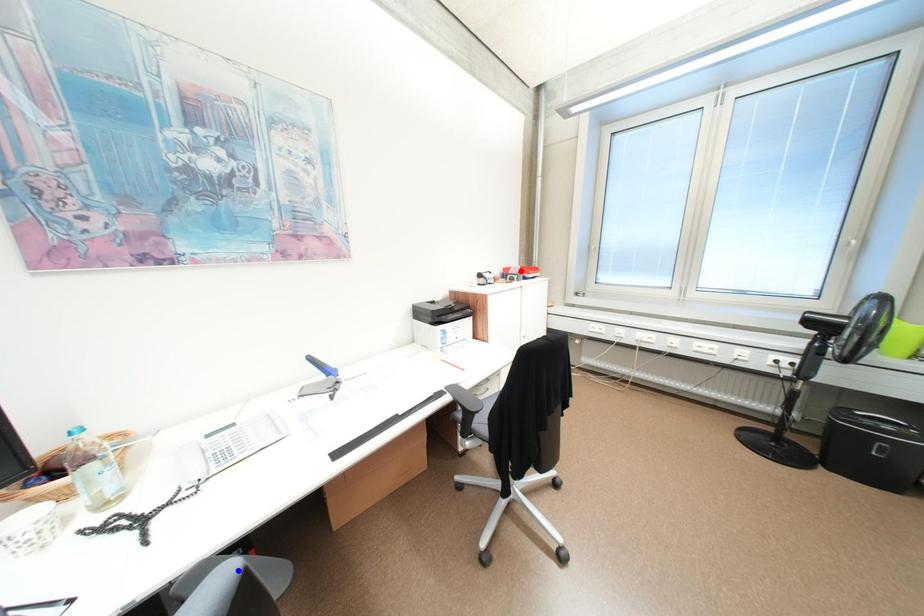
Question: Which of the two points in the image is closer to the camera?

Choices:
 (A) Blue point is closer.
 (B) Red point is closer.

Answer: (A)